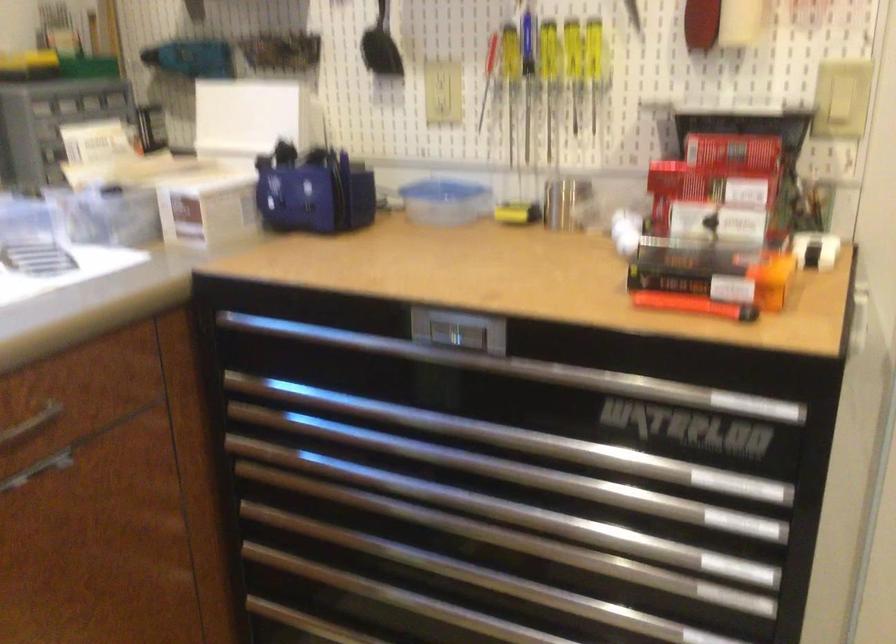
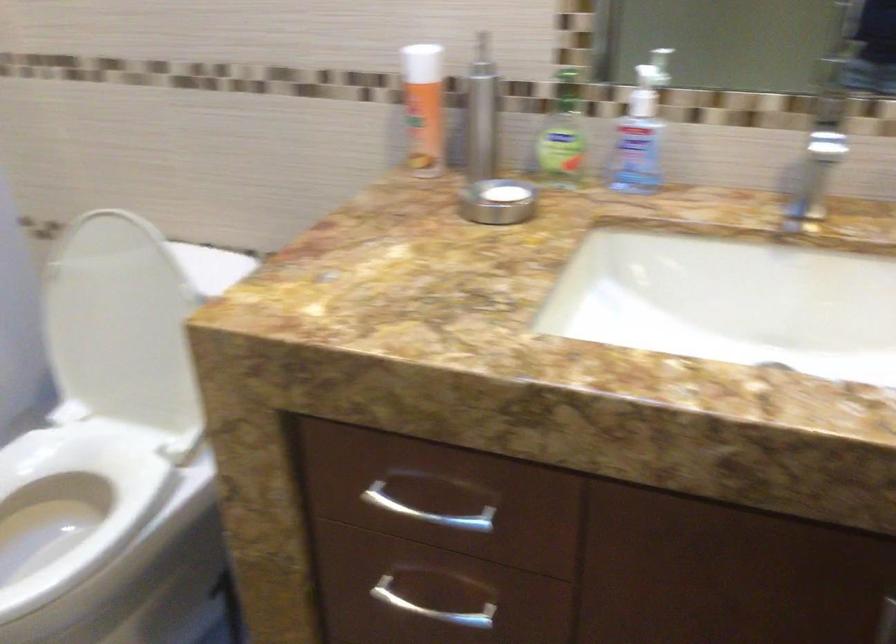
In a continuous first-person perspective shot, in which direction is the camera moving?

The cameraman walked toward right, backward.